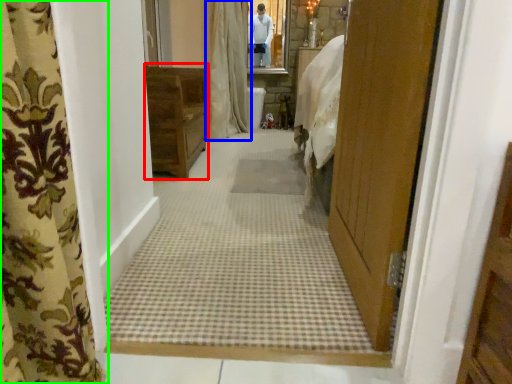
Question: Which object is positioned farthest from furniture (highlighted by a red box)? Select from curtain (highlighted by a blue box) and curtain (highlighted by a green box).

Choices:
 (A) curtain
 (B) curtain

Answer: (B)